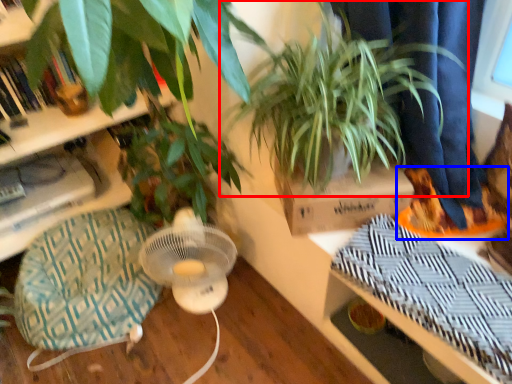
Question: Among these objects, which one is nearest to the camera, houseplant (highlighted by a red box) or shoe (highlighted by a blue box)?

Choices:
 (A) houseplant
 (B) shoe

Answer: (A)